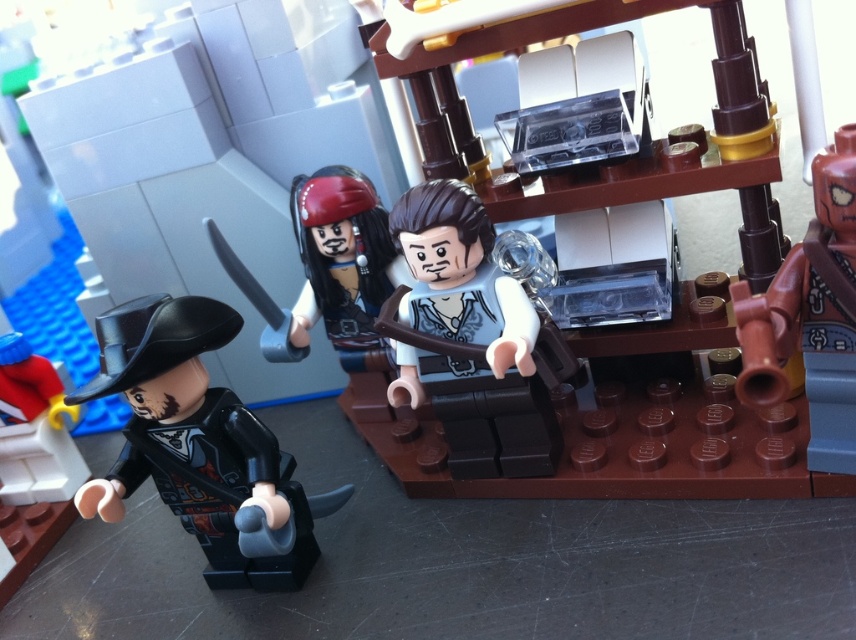
Question: Is black matte pirate hat at left wider than brown matte cannon at right?

Choices:
 (A) yes
 (B) no

Answer: (A)

Question: Is black matte pirate hat at left further to the viewer compared to matte black hat at lower left?

Choices:
 (A) no
 (B) yes

Answer: (A)

Question: Estimate the real-world distances between objects in this image. Which object is farther from the smooth gray vest at center?

Choices:
 (A) brown matte cannon at right
 (B) black matte pirate hat at left
 (C) matte black hat at lower left

Answer: (C)

Question: Which point is farther to the camera?

Choices:
 (A) (39, 396)
 (B) (123, 458)
 (C) (402, 234)

Answer: (A)

Question: Which point is closer to the camera taking this photo?

Choices:
 (A) (31, 362)
 (B) (551, 410)

Answer: (B)

Question: Is black matte pirate hat at left bigger than brown matte cannon at right?

Choices:
 (A) yes
 (B) no

Answer: (A)